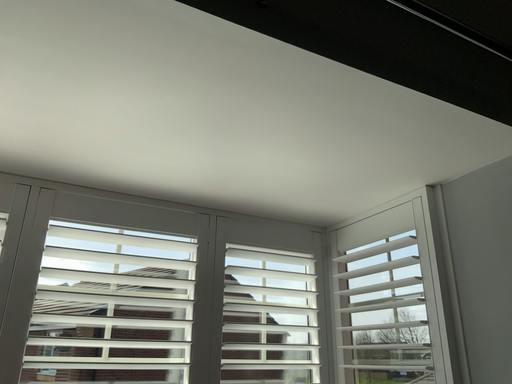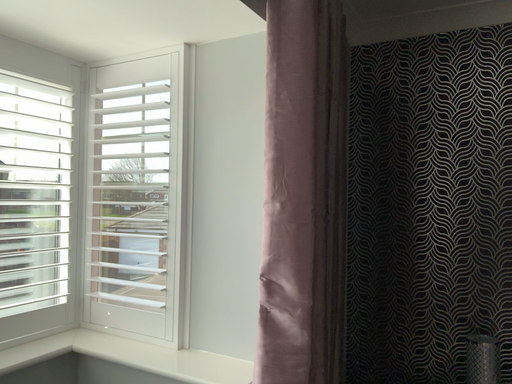
Question: How did the camera likely rotate when shooting the video?

Choices:
 (A) rotated downward
 (B) rotated upward

Answer: (A)